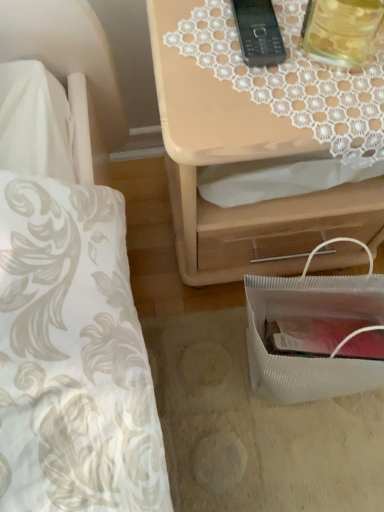
Question: From a real-world perspective, is light wood/texture nightstand at upper right beneath black plastic phone at upper center?

Choices:
 (A) yes
 (B) no

Answer: (A)

Question: Considering the relative positions of light wood/texture nightstand at upper right and black plastic phone at upper center in the image provided, is light wood/texture nightstand at upper right to the right of black plastic phone at upper center from the viewer's perspective?

Choices:
 (A) yes
 (B) no

Answer: (A)

Question: Is light wood/texture nightstand at upper right aimed at black plastic phone at upper center?

Choices:
 (A) no
 (B) yes

Answer: (A)

Question: Considering the relative sizes of light wood/texture nightstand at upper right and black plastic phone at upper center in the image provided, is light wood/texture nightstand at upper right shorter than black plastic phone at upper center?

Choices:
 (A) no
 (B) yes

Answer: (A)

Question: Would you consider light wood/texture nightstand at upper right to be distant from black plastic phone at upper center?

Choices:
 (A) no
 (B) yes

Answer: (A)

Question: Does point (342, 304) appear closer or farther from the camera than point (206, 87)?

Choices:
 (A) closer
 (B) farther

Answer: (B)

Question: Is white textured bag at lower right bigger or smaller than light wood/texture nightstand at upper right?

Choices:
 (A) small
 (B) big

Answer: (A)

Question: From the image's perspective, relative to light wood/texture nightstand at upper right, is white textured bag at lower right above or below?

Choices:
 (A) above
 (B) below

Answer: (B)

Question: Is white textured bag at lower right taller or shorter than light wood/texture nightstand at upper right?

Choices:
 (A) tall
 (B) short

Answer: (B)

Question: Is white textured bag at lower right to the left or to the right of translucent glass jar at upper right in the image?

Choices:
 (A) right
 (B) left

Answer: (A)

Question: In terms of height, does white textured bag at lower right look taller or shorter compared to translucent glass jar at upper right?

Choices:
 (A) short
 (B) tall

Answer: (B)

Question: Is white textured bag at lower right bigger or smaller than translucent glass jar at upper right?

Choices:
 (A) big
 (B) small

Answer: (A)

Question: Considering the positions of white textured bag at lower right and translucent glass jar at upper right in the image, is white textured bag at lower right wider or thinner than translucent glass jar at upper right?

Choices:
 (A) wide
 (B) thin

Answer: (A)

Question: Would you say black plastic phone at upper center is inside or outside translucent glass jar at upper right?

Choices:
 (A) outside
 (B) inside

Answer: (A)

Question: Considering the positions of black plastic phone at upper center and translucent glass jar at upper right in the image, is black plastic phone at upper center taller or shorter than translucent glass jar at upper right?

Choices:
 (A) tall
 (B) short

Answer: (B)